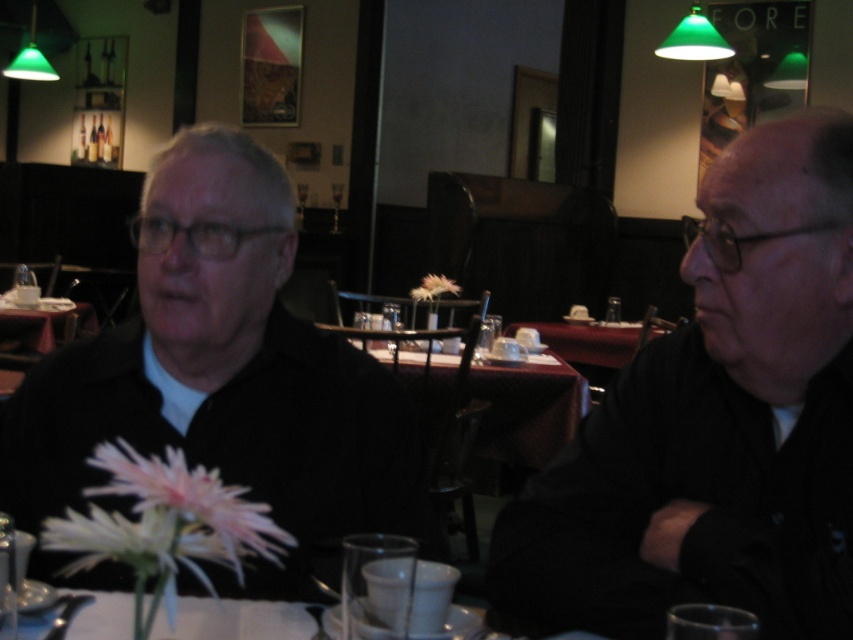
Does maroon fabric table at center appear on the left side of wooden table at center?

Incorrect, maroon fabric table at center is not on the left side of wooden table at center.

Is maroon fabric table at center bigger than wooden table at center?

Indeed, maroon fabric table at center has a larger size compared to wooden table at center.

The image size is (853, 640). What do you see at coordinates (525, 410) in the screenshot? I see `maroon fabric table at center` at bounding box center [525, 410].

I want to click on maroon fabric table at center, so click(525, 410).

Who is taller, black matte jacket at right or black matte jacket at left?

Standing taller between the two is black matte jacket at left.

Where is `black matte jacket at right`? This screenshot has height=640, width=853. black matte jacket at right is located at coordinates (717, 422).

Is point (793, 609) positioned after point (439, 419)?

No, it is in front of (439, 419).

This screenshot has width=853, height=640. What do you see at coordinates (717, 422) in the screenshot?
I see `black matte jacket at right` at bounding box center [717, 422].

This screenshot has width=853, height=640. In order to click on black matte jacket at right in this screenshot , I will do `click(717, 422)`.